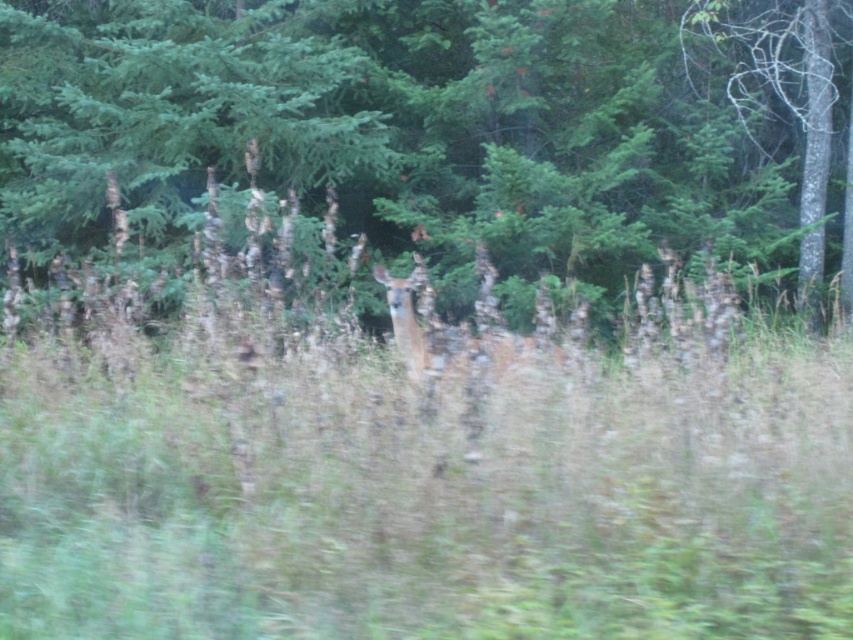
Does green grass at center have a lesser width compared to green matte tree at center?

Incorrect, green grass at center's width is not less than green matte tree at center's.

Can you confirm if green grass at center is smaller than green matte tree at center?

No, green grass at center is not smaller than green matte tree at center.

Identify the location of green grass at center. (428, 500).

Is point (469, 26) positioned before point (810, 74)?

Yes, it is in front of point (810, 74).

Between green matte tree at center and smooth bark tree at right, which one is positioned higher?

green matte tree at center

Describe the element at coordinates (437, 124) in the screenshot. The width and height of the screenshot is (853, 640). I see `green matte tree at center` at that location.

The width and height of the screenshot is (853, 640). I want to click on green matte tree at center, so click(437, 124).

What do you see at coordinates (428, 500) in the screenshot? I see `green grass at center` at bounding box center [428, 500].

Is point (352, 426) closer to viewer compared to point (791, 86)?

Yes, it is.

Where is `green grass at center`? green grass at center is located at coordinates (428, 500).